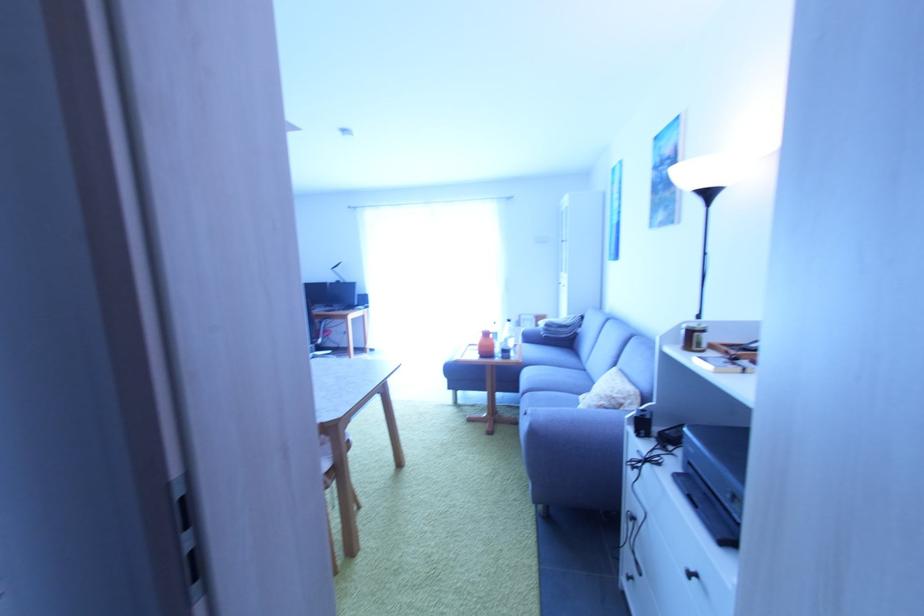
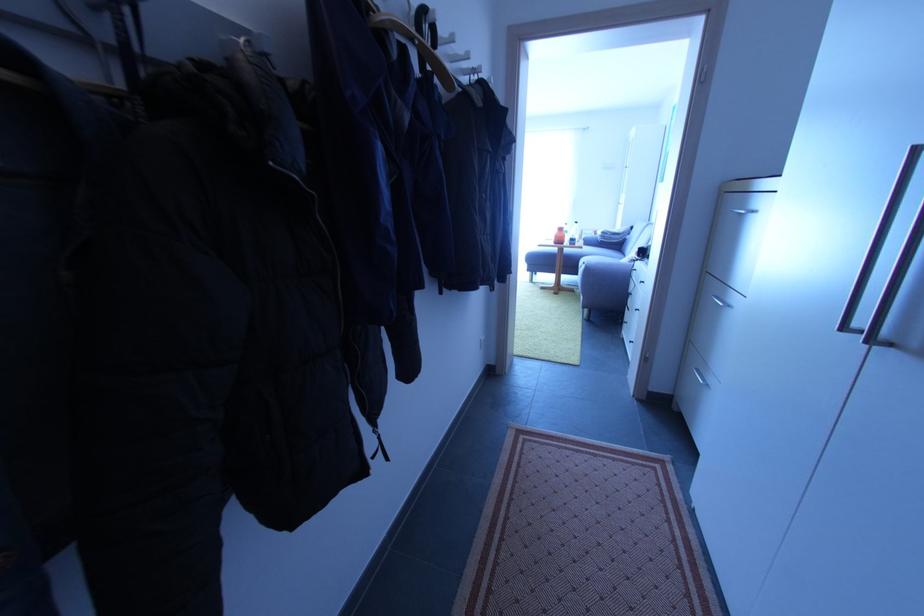
Locate, in the second image, the point that corresponds to (x=528, y=395) in the first image.

(586, 268)